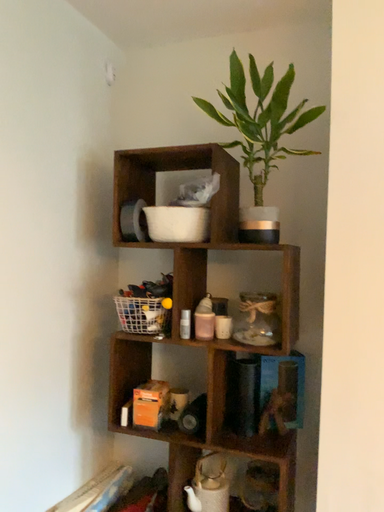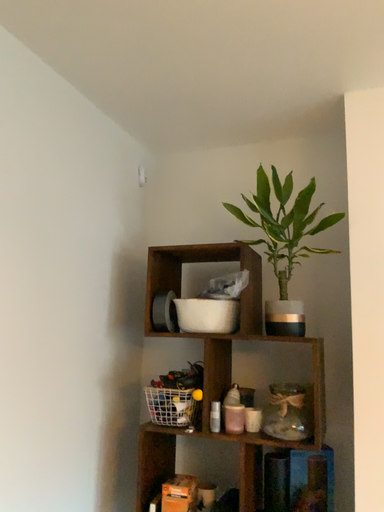
Question: How did the camera likely rotate when shooting the video?

Choices:
 (A) rotated downward
 (B) rotated upward

Answer: (B)